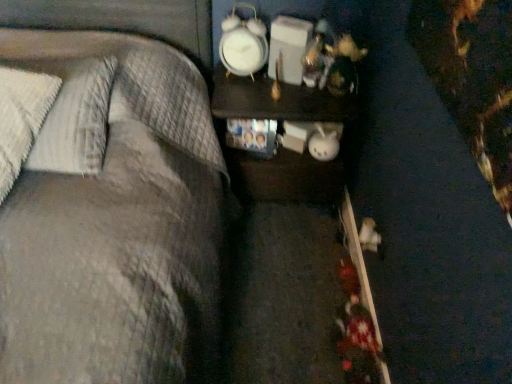
Identify the location of free space in front of white plastic clock at upper center. The height and width of the screenshot is (384, 512). (243, 95).